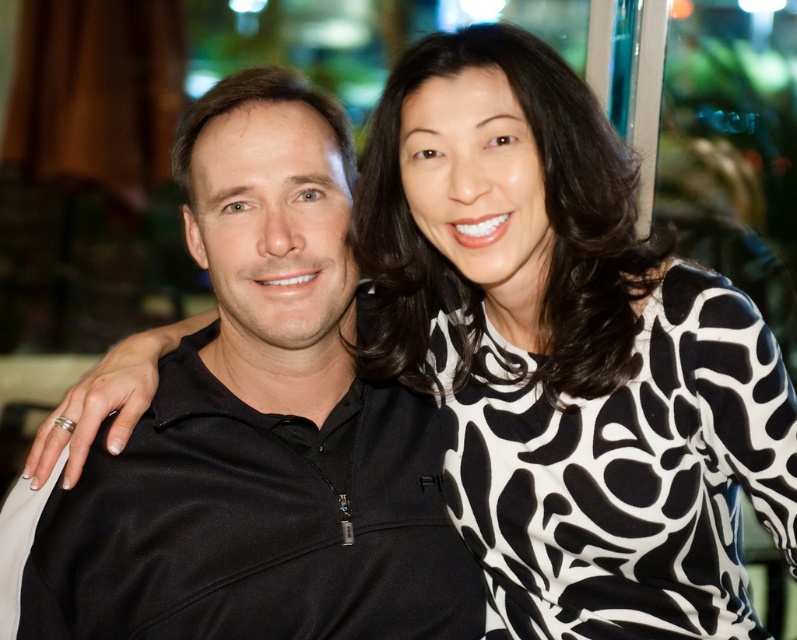
What are the coordinates of the black and white printed blouse at upper right in the image?

The black and white printed blouse at upper right is located at coordinates point [571,358].

You are a photographer adjusting the focus on your camera. You want to ensure that both the black and white printed blouse at upper right and the black matte jacket at center are in sharp focus. Based on their positions, will you need to adjust the depth of field to include both objects?

The black and white printed blouse at upper right is closer to the viewer than the black matte jacket at center. To have both in sharp focus, you would need to increase the depth of field or adjust the focus point to accommodate the distance between them.

You are taking a photo of two people standing close together. The person on the right is wearing a black and white printed blouse at upper right, and the person on the left is wearing a black matte jacket at center. Based on their clothing positions, which clothing item is lower in the image?

The black and white printed blouse at upper right is below the black matte jacket at center, so it is lower in the image.